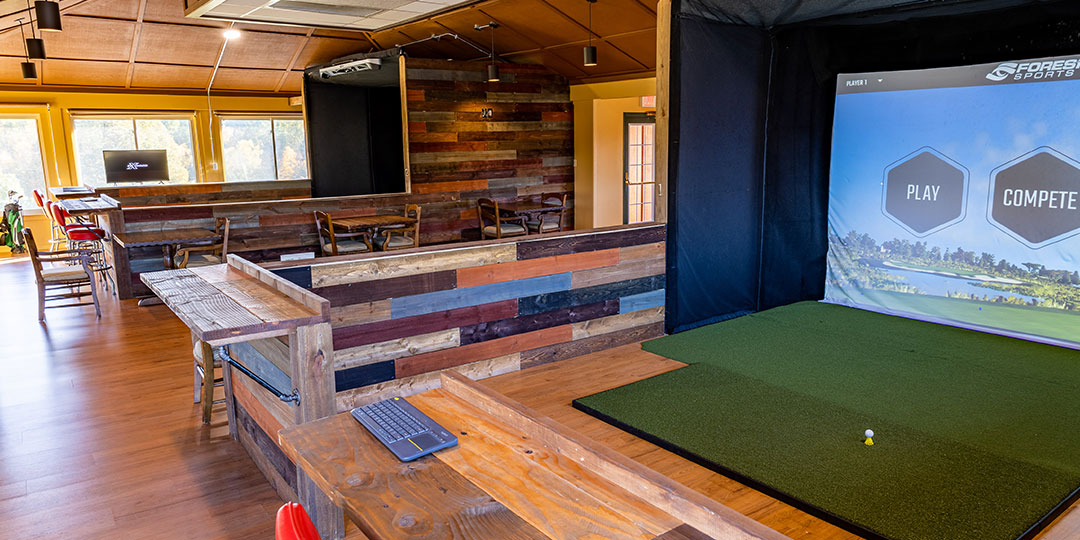
Find the location of a particular element. The width and height of the screenshot is (1080, 540). chair is located at coordinates (63, 266).